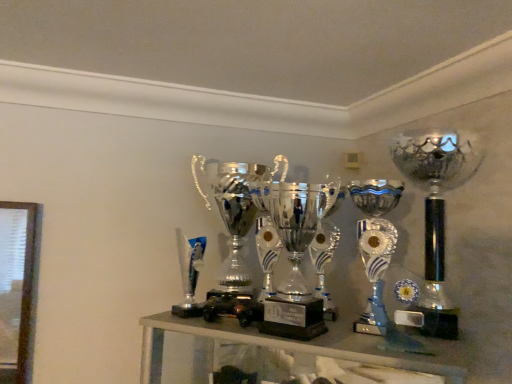
Question: From the image's perspective, is silver/metallic trophy at right, acting as the 1th trophy starting from the right, on top of shiny silver trophy at center, positioned as the 2th trophy in right-to-left order?

Choices:
 (A) yes
 (B) no

Answer: (A)

Question: Does silver/metallic trophy at right, acting as the 1th trophy starting from the right, appear on the left side of shiny silver trophy at center, positioned as the 2th trophy in right-to-left order?

Choices:
 (A) yes
 (B) no

Answer: (B)

Question: From a real-world perspective, is silver/metallic trophy at right, arranged as the 3th trophy when viewed from the left, located higher than shiny silver trophy at center, which is the second trophy in left-to-right order?

Choices:
 (A) yes
 (B) no

Answer: (A)

Question: Does silver/metallic trophy at right, acting as the 1th trophy starting from the right, have a lesser height compared to shiny silver trophy at center, positioned as the 2th trophy in right-to-left order?

Choices:
 (A) no
 (B) yes

Answer: (A)

Question: Does silver/metallic trophy at right, arranged as the 3th trophy when viewed from the left, have a larger size compared to shiny silver trophy at center, positioned as the 2th trophy in right-to-left order?

Choices:
 (A) no
 (B) yes

Answer: (B)

Question: From a real-world perspective, is polished silver trophy at center, which is the 3th trophy in right-to-left order, above or below silver/metallic trophy at right, arranged as the 3th trophy when viewed from the left?

Choices:
 (A) above
 (B) below

Answer: (B)

Question: In terms of width, does polished silver trophy at center, which is the 3th trophy in right-to-left order, look wider or thinner when compared to silver/metallic trophy at right, arranged as the 3th trophy when viewed from the left?

Choices:
 (A) wide
 (B) thin

Answer: (B)

Question: From the image's perspective, is polished silver trophy at center, which is the 3th trophy in right-to-left order, positioned above or below silver/metallic trophy at right, arranged as the 3th trophy when viewed from the left?

Choices:
 (A) above
 (B) below

Answer: (B)

Question: Would you say polished silver trophy at center, positioned as the 1th trophy in left-to-right order, is to the left or to the right of silver/metallic trophy at right, arranged as the 3th trophy when viewed from the left, in the picture?

Choices:
 (A) right
 (B) left

Answer: (B)

Question: From a real-world perspective, relative to polished silver trophy at center, which is the 3th trophy in right-to-left order, is silver/metallic trophy at right, acting as the 1th trophy starting from the right, vertically above or below?

Choices:
 (A) above
 (B) below

Answer: (A)

Question: From their relative heights in the image, would you say silver/metallic trophy at right, arranged as the 3th trophy when viewed from the left, is taller or shorter than polished silver trophy at center, positioned as the 1th trophy in left-to-right order?

Choices:
 (A) short
 (B) tall

Answer: (B)

Question: Is silver/metallic trophy at right, acting as the 1th trophy starting from the right, situated inside polished silver trophy at center, positioned as the 1th trophy in left-to-right order, or outside?

Choices:
 (A) inside
 (B) outside

Answer: (B)

Question: Based on their positions, is silver/metallic trophy at right, arranged as the 3th trophy when viewed from the left, located to the left or right of polished silver trophy at center, positioned as the 1th trophy in left-to-right order?

Choices:
 (A) right
 (B) left

Answer: (A)

Question: Considering the relative positions of shiny silver trophy at center, positioned as the 2th trophy in right-to-left order, and polished silver trophy at center, positioned as the 1th trophy in left-to-right order, in the image provided, is shiny silver trophy at center, positioned as the 2th trophy in right-to-left order, to the left or to the right of polished silver trophy at center, positioned as the 1th trophy in left-to-right order,?

Choices:
 (A) right
 (B) left

Answer: (A)

Question: In terms of height, does shiny silver trophy at center, positioned as the 2th trophy in right-to-left order, look taller or shorter compared to polished silver trophy at center, which is the 3th trophy in right-to-left order?

Choices:
 (A) short
 (B) tall

Answer: (A)